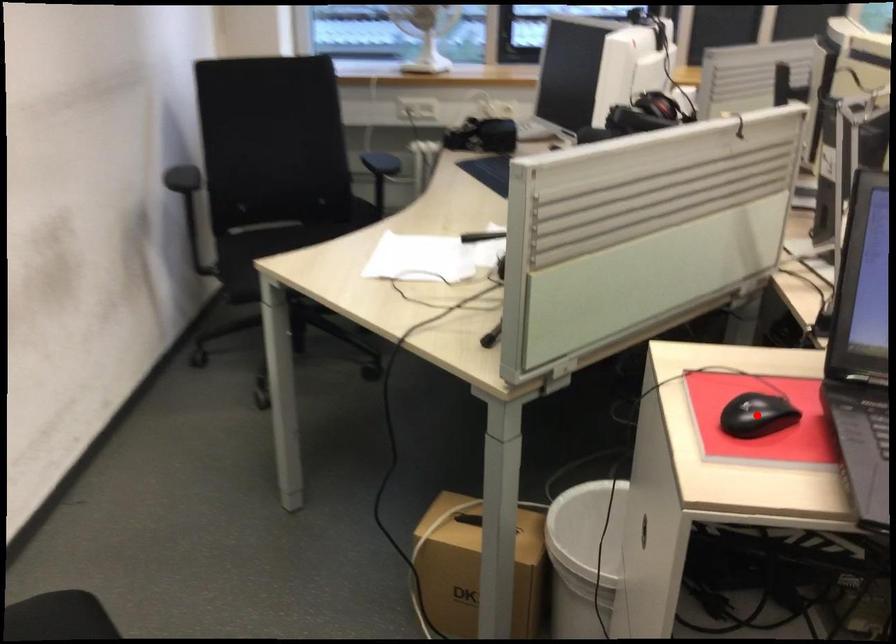
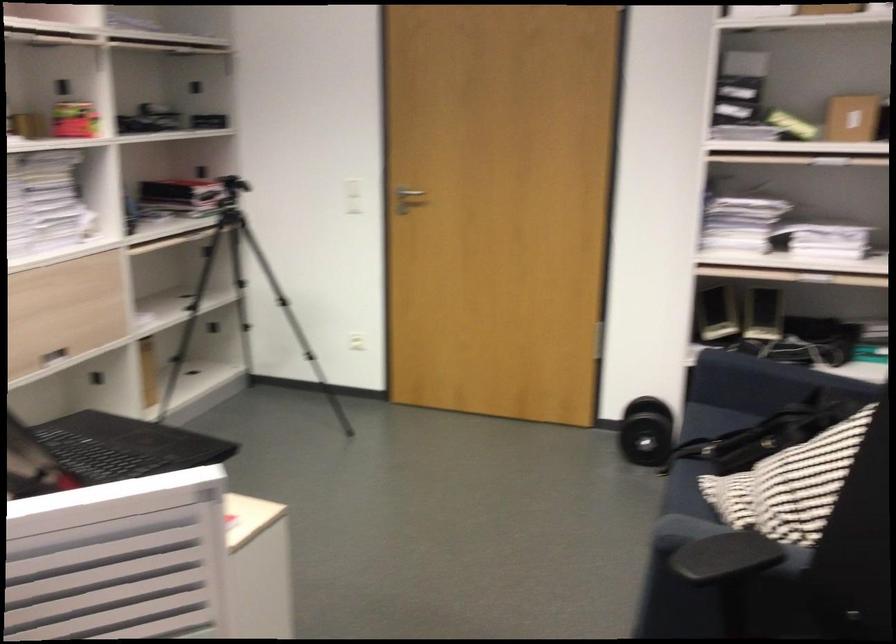
Question: I am providing you with two images of the same scene from different viewpoints. A red point is marked on the first image. Is the red point's position out of view in image 2?

Choices:
 (A) Yes
 (B) No

Answer: (A)